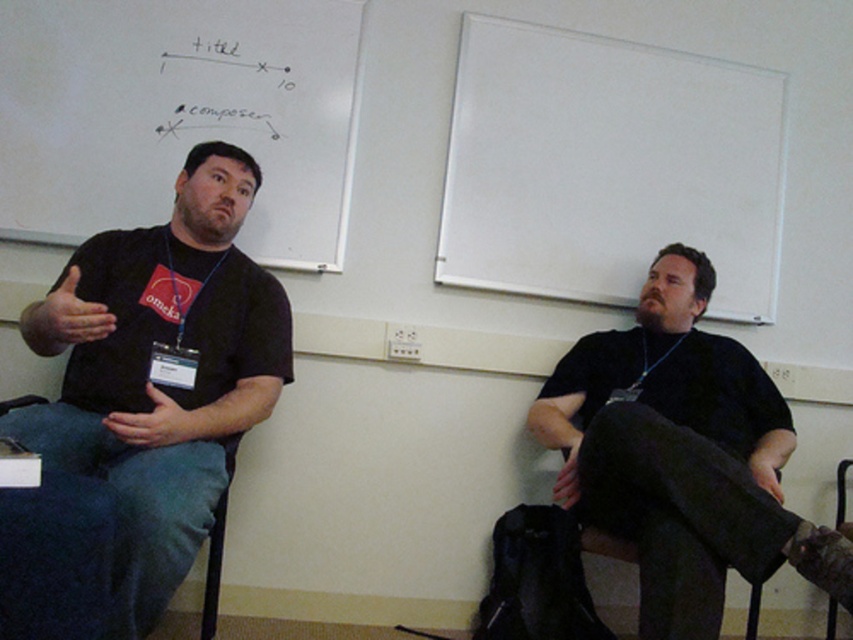
Question: Does matte black shirt at left appear under black paper at upper left?

Choices:
 (A) yes
 (B) no

Answer: (A)

Question: Considering the real-world distances, which object is farthest from the white matte whiteboard at upper left?

Choices:
 (A) matte black shirt at left
 (B) white matte board at upper center
 (C) black matte shirt at center

Answer: (C)

Question: Which is farther from the matte black shirt at left?

Choices:
 (A) white matte whiteboard at upper left
 (B) black matte shirt at center
 (C) white matte board at upper center

Answer: (C)

Question: Can you confirm if white matte whiteboard at upper left is positioned below black paper at upper left?

Choices:
 (A) no
 (B) yes

Answer: (B)

Question: Can you confirm if white matte board at upper center is positioned below white matte whiteboard at upper left?

Choices:
 (A) yes
 (B) no

Answer: (A)

Question: Which of the following is the farthest from the observer?

Choices:
 (A) (698, 179)
 (B) (695, 307)
 (C) (242, 131)

Answer: (A)